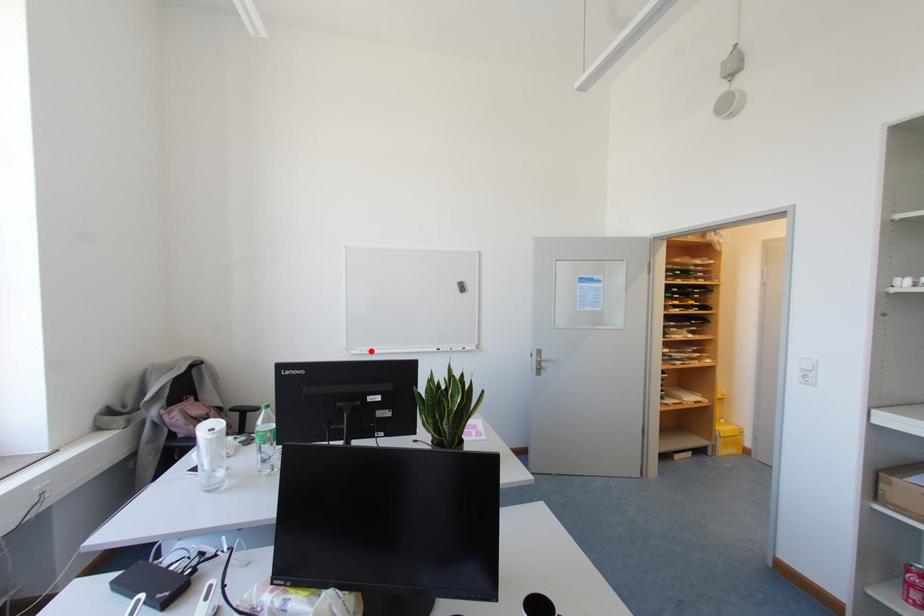
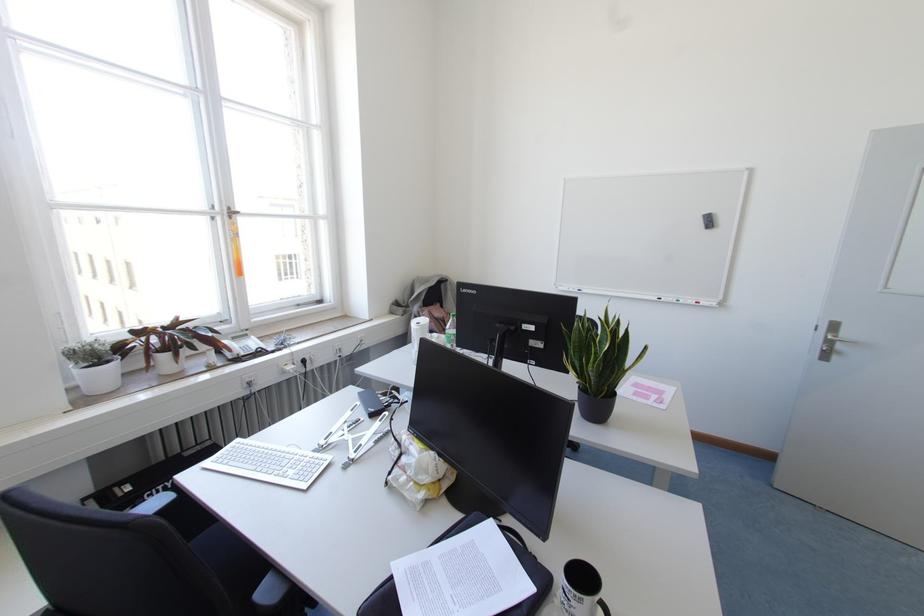
Locate, in the second image, the point that corresponds to the highlighted location in the first image.

(578, 290)